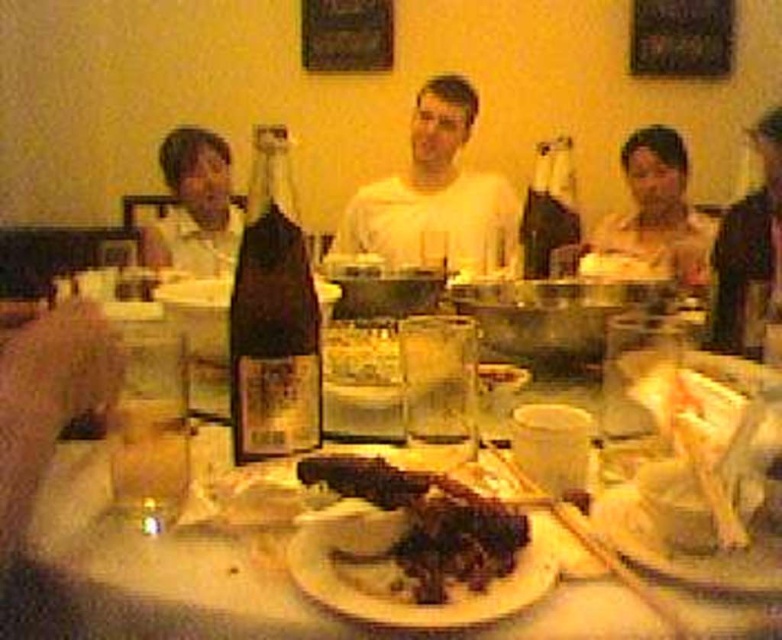
You are a waiter in a restaurant and need to place a small appetizer between the dark brown leather jacket at right and the matte black shirt at left. Based on their heights, which object should the appetizer be placed closer to?

The dark brown leather jacket at right has a lesser height compared to matte black shirt at left. Therefore, the appetizer should be placed closer to the matte black shirt at left to ensure it is visible and accessible.